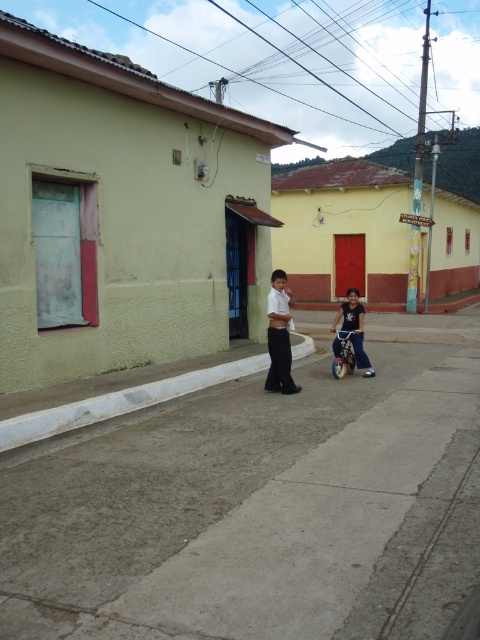
Question: Which object is positioned farthest from the gray concrete pavement at center?

Choices:
 (A) metallic silver stroller at center
 (B) dark blue denim shorts at center
 (C) white concrete curb at lower center

Answer: (B)

Question: Which point appears farthest from the camera in this image?

Choices:
 (A) (45, 435)
 (B) (345, 342)
 (C) (360, 323)
 (D) (469, 397)

Answer: (B)

Question: Does white concrete curb at lower center have a greater width compared to metallic silver stroller at center?

Choices:
 (A) no
 (B) yes

Answer: (B)

Question: Among these objects, which one is nearest to the camera?

Choices:
 (A) metallic silver stroller at center
 (B) dark blue denim shorts at center
 (C) white concrete curb at lower center

Answer: (C)

Question: Is gray concrete pavement at center closer to the viewer compared to white concrete curb at lower center?

Choices:
 (A) yes
 (B) no

Answer: (A)

Question: Considering the relative positions of gray concrete pavement at center and dark blue denim shorts at center in the image provided, where is gray concrete pavement at center located with respect to dark blue denim shorts at center?

Choices:
 (A) left
 (B) right

Answer: (A)